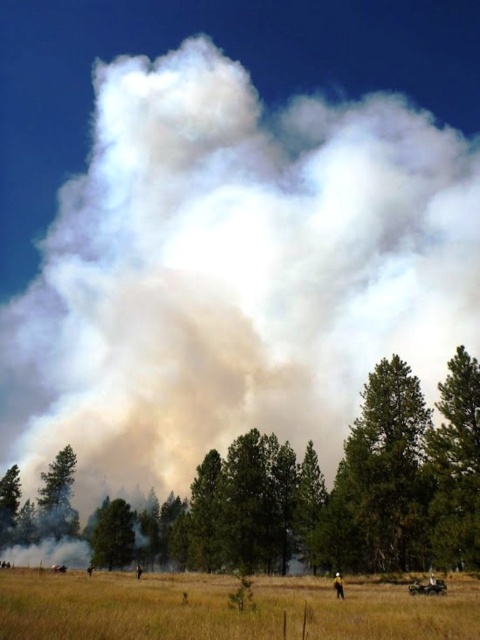
Is dry grass at lower center above green textured tree at right?

No.

Does dry grass at lower center have a smaller size compared to green textured tree at right?

No, dry grass at lower center is not smaller than green textured tree at right.

Is point (81, 628) farther from viewer compared to point (466, 515)?

No, it is not.

You are a GUI agent. You are given a task and a screenshot of the screen. Output one action in this format:
    pyautogui.click(x=<x>, y=<y>)
    Task: Click on the dry grass at lower center
    Image resolution: width=480 pixels, height=640 pixels.
    Given the screenshot: What is the action you would take?
    pyautogui.click(x=223, y=609)

Does green textured tree at right appear on the right side of green matte tree at lower center?

Correct, you'll find green textured tree at right to the right of green matte tree at lower center.

Where is `green textured tree at right`? Image resolution: width=480 pixels, height=640 pixels. green textured tree at right is located at coordinates pyautogui.click(x=456, y=465).

Image resolution: width=480 pixels, height=640 pixels. Find the location of `green textured tree at right`. green textured tree at right is located at coordinates (456, 465).

What are the coordinates of `green textured tree at right` in the screenshot? It's located at (456, 465).

Who is more distant from viewer, (319,632) or (38,509)?

The point (38,509) is more distant.

What do you see at coordinates (223, 609) in the screenshot? I see `dry grass at lower center` at bounding box center [223, 609].

Which is in front, point (289, 593) or point (55, 529)?

Positioned in front is point (289, 593).

Locate an element on the screen. This screenshot has width=480, height=640. dry grass at lower center is located at coordinates (223, 609).